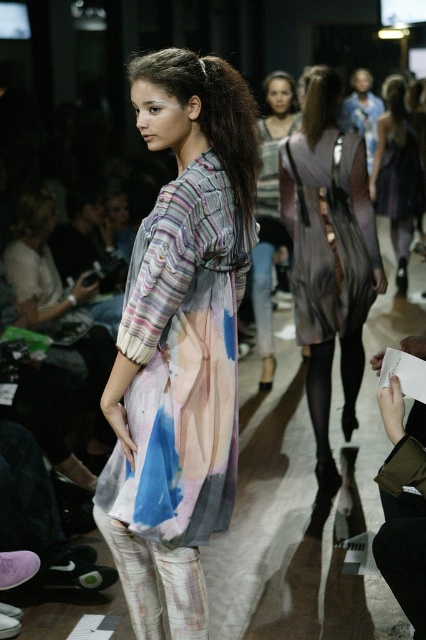
Is translucent tie-dye dress at center bigger than silky purple dress at center?

No, translucent tie-dye dress at center is not bigger than silky purple dress at center.

Is point (236, 212) farther from viewer compared to point (331, 106)?

No, (236, 212) is in front of (331, 106).

You are a GUI agent. You are given a task and a screenshot of the screen. Output one action in this format:
    pyautogui.click(x=<x>, y=<y>)
    Task: Click on the translucent tie-dye dress at center
    This screenshot has height=640, width=426.
    Given the screenshot: What is the action you would take?
    pyautogui.click(x=180, y=340)

Can you confirm if silky purple dress at center is smaller than matte purple dress at center?

Yes, silky purple dress at center is smaller than matte purple dress at center.

Can you confirm if silky purple dress at center is thinner than matte purple dress at center?

Yes, silky purple dress at center is thinner than matte purple dress at center.

Which is in front, point (336, 93) or point (389, 106)?

Point (336, 93) is in front.

At what (x,y) coordinates should I click in order to perform the action: click on silky purple dress at center. Please return your answer as a coordinate pair (x, y). Looking at the image, I should click on (328, 252).

Which is more to the left, silky purple dress at center or striped fabric dress at center?

striped fabric dress at center

Does silky purple dress at center have a greater height compared to striped fabric dress at center?

No.

Find the location of a particular element. The image size is (426, 640). silky purple dress at center is located at coordinates (328, 252).